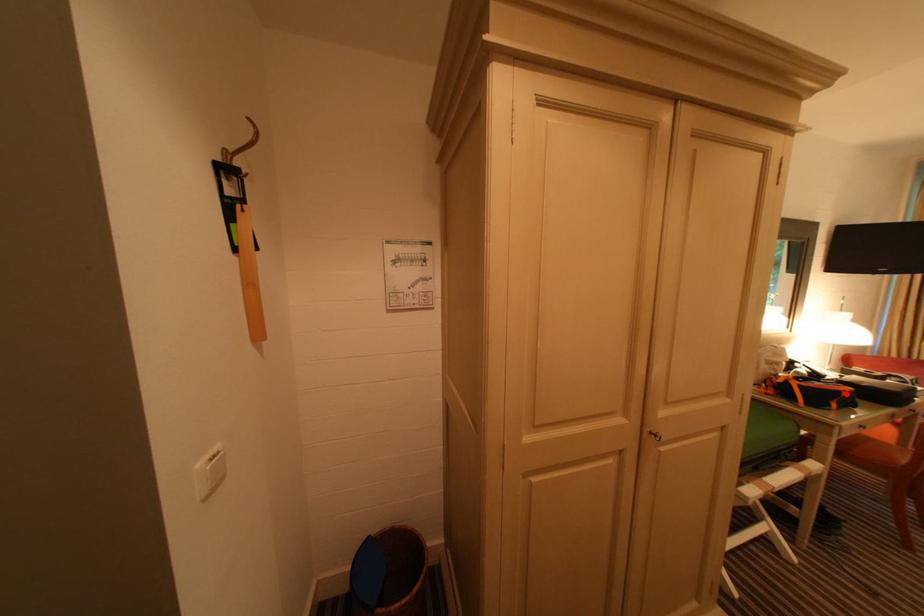
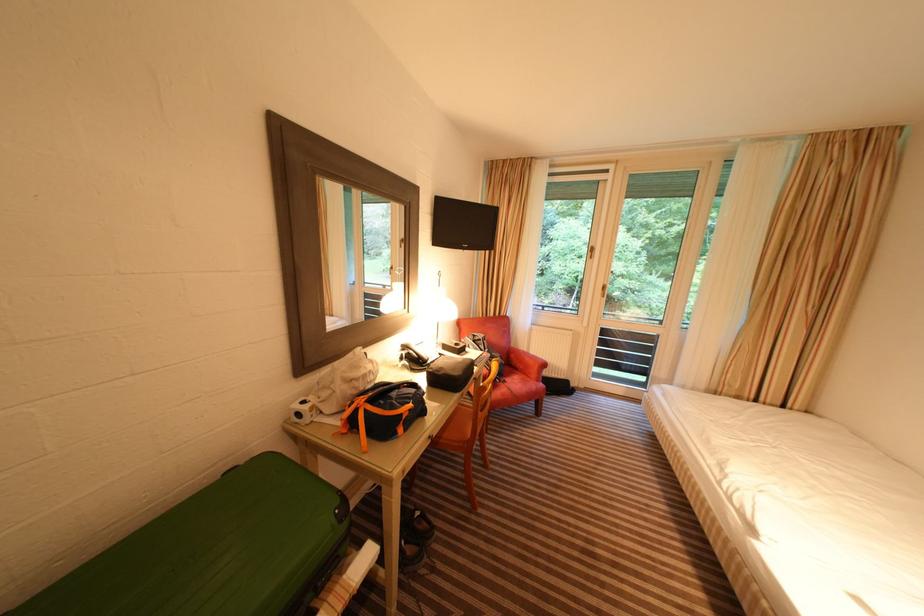
Where in the second image is the point corresponding to the highlighted location from the first image?

(407, 416)